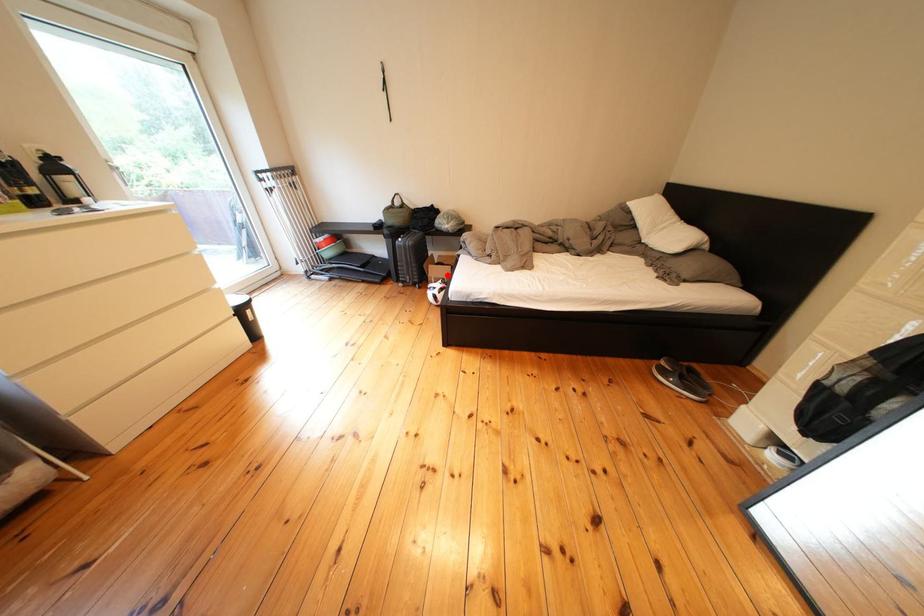
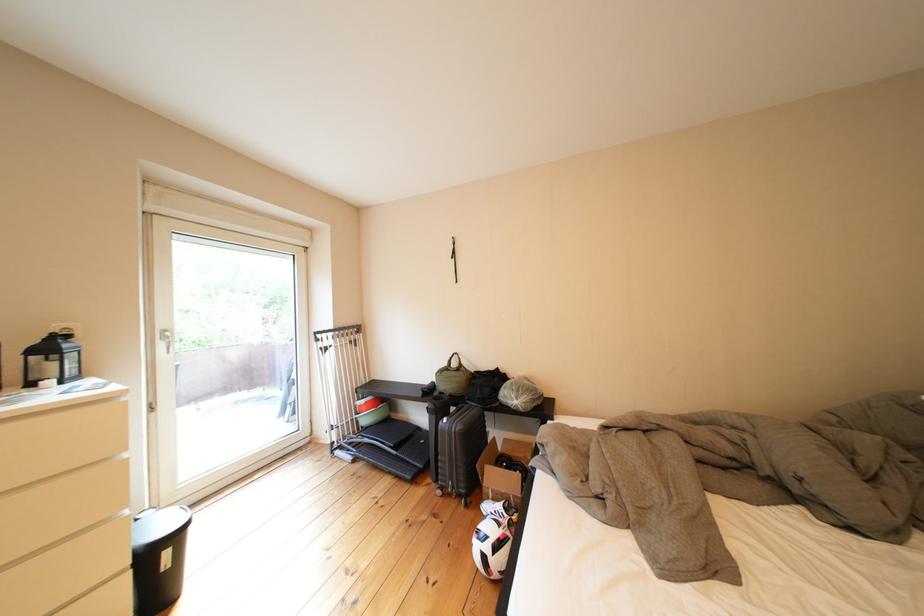
Question: I am providing you with two images of the same scene from different viewpoints. Image1 has a red point marked. In image2, the corresponding 3D location appears at what relative position? Reply with the corresponding letter.

Choices:
 (A) Closer
 (B) Farther

Answer: (A)